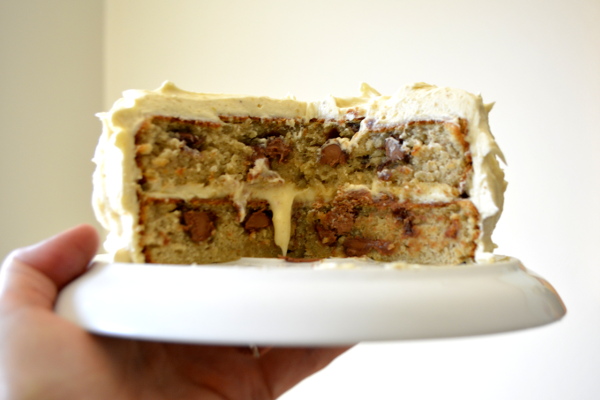
Find the location of a particular element. plate is located at coordinates (355, 307).